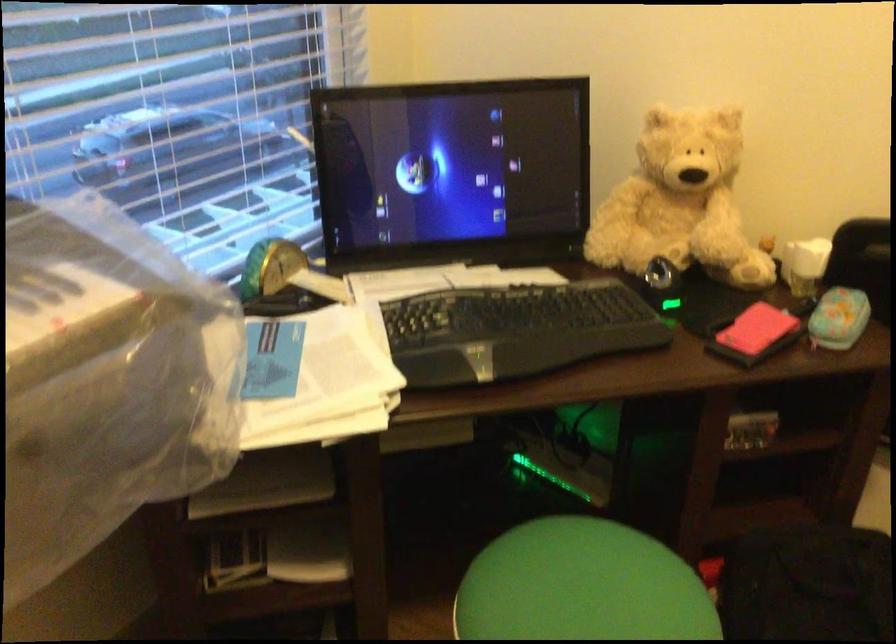
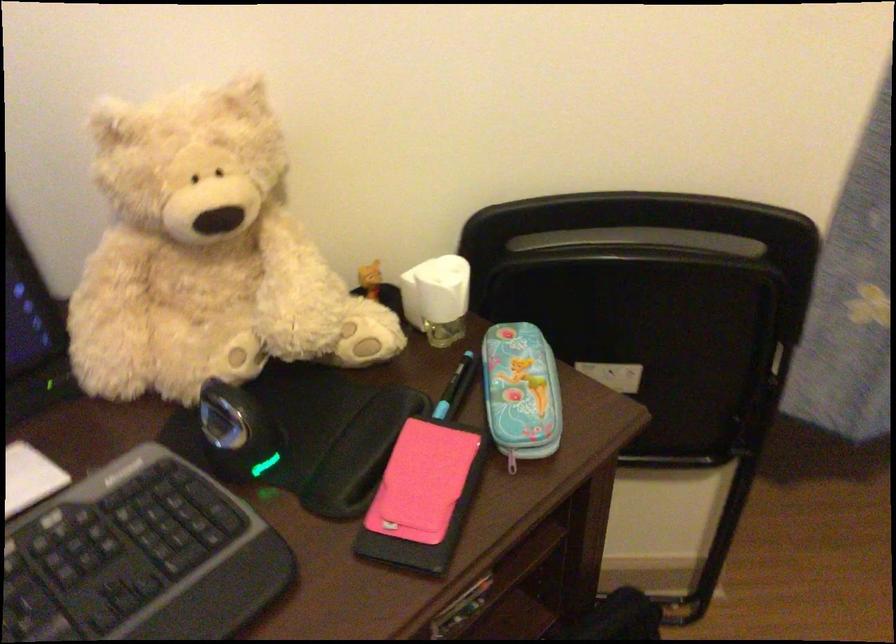
Question: The camera is either moving clockwise (left) or counter-clockwise (right) around the object. The first image is from the beginning of the video and the second image is from the end. Is the camera moving left or right when shooting the video?

Choices:
 (A) Left
 (B) Right

Answer: (A)